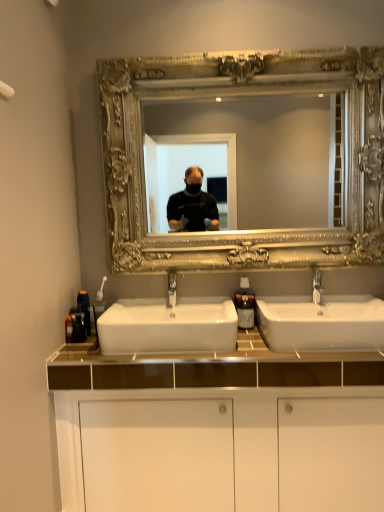
The image size is (384, 512). I want to click on free space in front of translucent plastic bottle at left, the second toiletry in the back-to-front sequence, so click(86, 356).